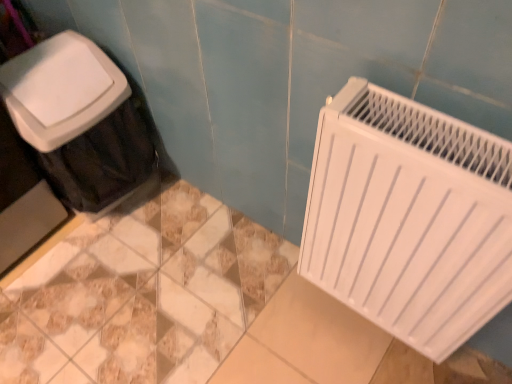
Question: Considering the relative sizes of white plastic trash can at left and white matte radiator at right in the image provided, is white plastic trash can at left wider than white matte radiator at right?

Choices:
 (A) no
 (B) yes

Answer: (B)

Question: Does white plastic trash can at left have a smaller size compared to white matte radiator at right?

Choices:
 (A) no
 (B) yes

Answer: (A)

Question: Is white plastic trash can at left thinner than white matte radiator at right?

Choices:
 (A) yes
 (B) no

Answer: (B)

Question: From the image's perspective, is white plastic trash can at left below white matte radiator at right?

Choices:
 (A) no
 (B) yes

Answer: (A)

Question: Does white plastic trash can at left have a greater height compared to white matte radiator at right?

Choices:
 (A) no
 (B) yes

Answer: (B)

Question: From a real-world perspective, is white plastic trash can at left positioned under white matte radiator at right based on gravity?

Choices:
 (A) yes
 (B) no

Answer: (A)

Question: Does white matte radiator at right have a lesser height compared to white plastic trash can at left?

Choices:
 (A) no
 (B) yes

Answer: (B)

Question: Would you consider white matte radiator at right to be distant from white plastic trash can at left?

Choices:
 (A) no
 (B) yes

Answer: (A)

Question: Is white matte radiator at right positioned before white plastic trash can at left?

Choices:
 (A) yes
 (B) no

Answer: (A)

Question: Does white matte radiator at right have a greater height compared to white plastic trash can at left?

Choices:
 (A) yes
 (B) no

Answer: (B)

Question: Considering the relative sizes of white matte radiator at right and white plastic trash can at left in the image provided, is white matte radiator at right wider than white plastic trash can at left?

Choices:
 (A) yes
 (B) no

Answer: (B)

Question: From a real-world perspective, is white matte radiator at right positioned under white plastic trash can at left based on gravity?

Choices:
 (A) yes
 (B) no

Answer: (B)

Question: Considering the positions of white matte radiator at right and white plastic trash can at left in the image, is white matte radiator at right taller or shorter than white plastic trash can at left?

Choices:
 (A) short
 (B) tall

Answer: (A)